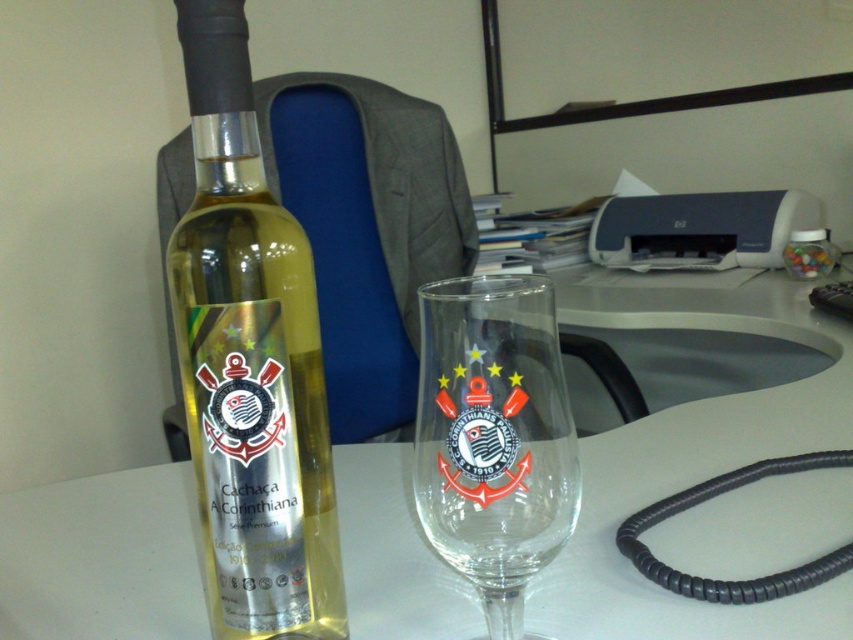
Question: Which object is positioned farthest from the translucent glass bottle at center?

Choices:
 (A) white glossy table at center
 (B) transparent glass at center

Answer: (A)

Question: Is translucent glass bottle at center bigger than transparent glass at center?

Choices:
 (A) no
 (B) yes

Answer: (B)

Question: Which point is farther to the camera?

Choices:
 (A) (381, 561)
 (B) (448, 436)

Answer: (A)

Question: Which point is farther from the camera taking this photo?

Choices:
 (A) (303, 499)
 (B) (453, 289)

Answer: (A)

Question: From the image, what is the correct spatial relationship of white glossy table at center in relation to translucent glass bottle at center?

Choices:
 (A) right
 (B) left

Answer: (A)

Question: Does white glossy table at center appear over transparent glass at center?

Choices:
 (A) no
 (B) yes

Answer: (B)